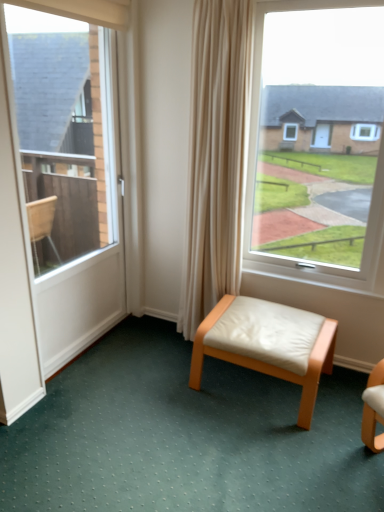
In order to click on vacant area situated below white leather stool at center (from a real-world perspective) in this screenshot , I will do `click(255, 386)`.